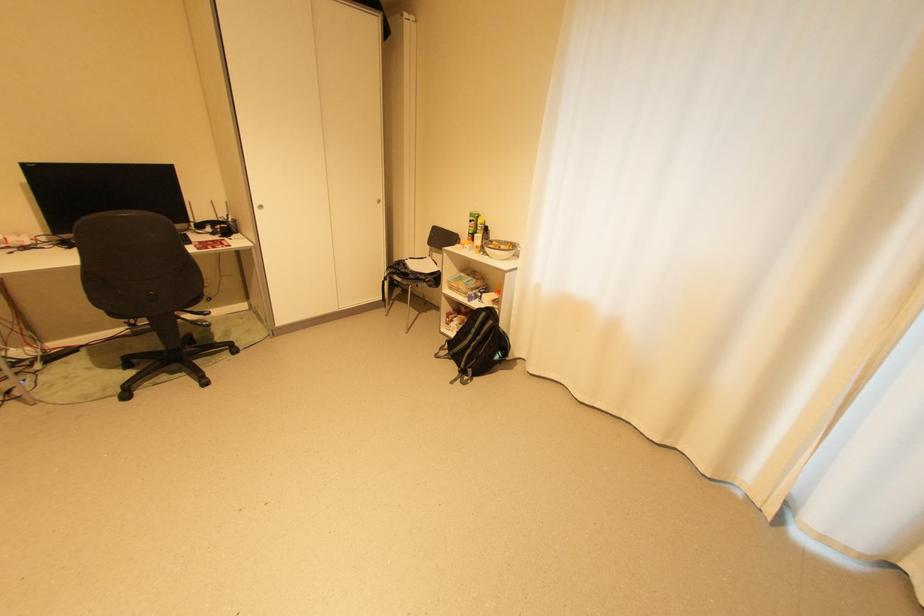
Where would you lift the black backpack? Please return your answer as a coordinate pair (x, y).

(477, 345)